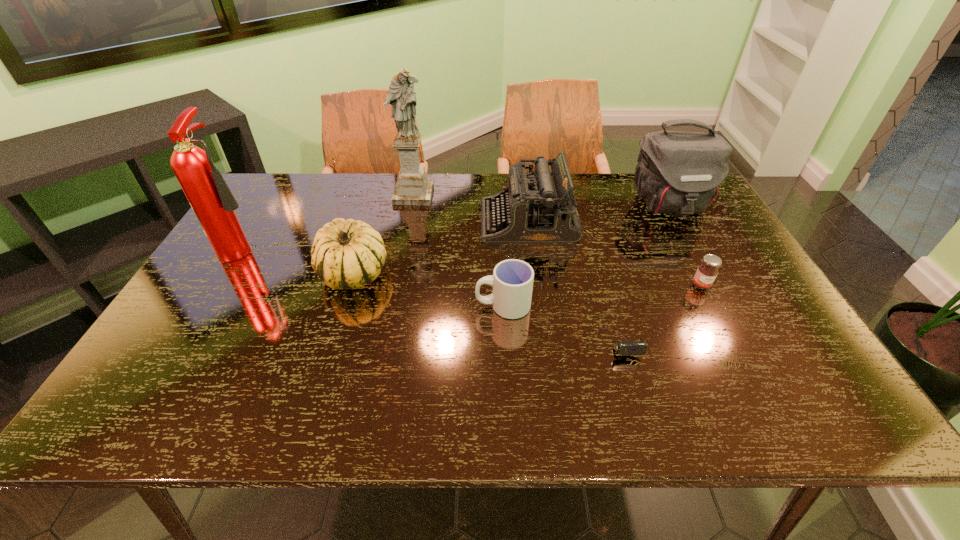
Where is `sculpture that is at the far edge`? Image resolution: width=960 pixels, height=540 pixels. sculpture that is at the far edge is located at coordinates (412, 187).

Locate an element on the screen. This screenshot has height=540, width=960. shoulder bag that is at the far edge is located at coordinates (678, 172).

Identify the location of typewriter that is at the far edge. (537, 207).

At what (x,y) coordinates should I click in order to perform the action: click on object that is at the left edge. Please return your answer as a coordinate pair (x, y). The image size is (960, 540). Looking at the image, I should click on (213, 203).

You are a GUI agent. You are given a task and a screenshot of the screen. Output one action in this format:
    pyautogui.click(x=<x>, y=<y>)
    Task: Click on the shoulder bag at the right edge
    This screenshot has width=960, height=540.
    Given the screenshot: What is the action you would take?
    pyautogui.click(x=678, y=172)

Find the location of a particular element. The width and height of the screenshot is (960, 540). jam present at the right edge is located at coordinates (707, 271).

The height and width of the screenshot is (540, 960). In order to click on object that is at the far right corner in this screenshot , I will do `click(678, 172)`.

The height and width of the screenshot is (540, 960). What are the coordinates of `vacant area at the far edge of the desktop` in the screenshot? It's located at (502, 181).

In the image, there is a desktop. Where is `vacant area at the near edge`? The image size is (960, 540). vacant area at the near edge is located at coordinates (276, 393).

What are the coordinates of `vacant space at the left edge of the desktop` in the screenshot? It's located at (248, 299).